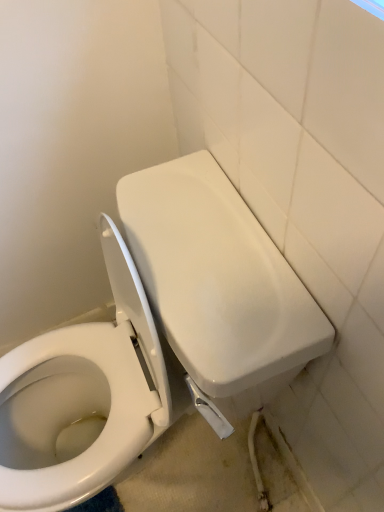
What do you see at coordinates (157, 339) in the screenshot?
I see `white glossy toilet at center` at bounding box center [157, 339].

The height and width of the screenshot is (512, 384). I want to click on white glossy toilet at center, so click(157, 339).

The image size is (384, 512). Identify the location of white glossy toilet at center. (157, 339).